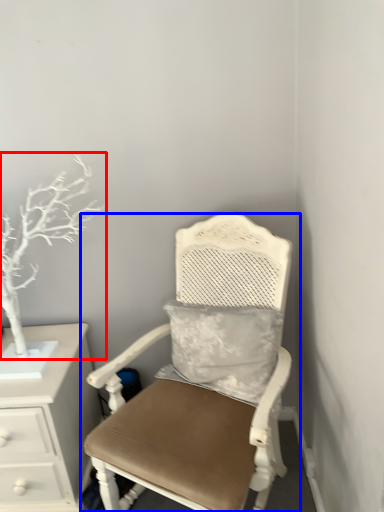
Question: Which of the following is the farthest to the observer, tree (highlighted by a red box) or chair (highlighted by a blue box)?

Choices:
 (A) tree
 (B) chair

Answer: (A)